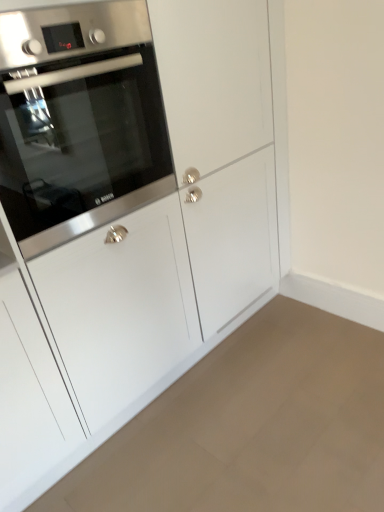
I want to click on free space above matte white cabinet at lower left (from a real-world perspective), so click(252, 408).